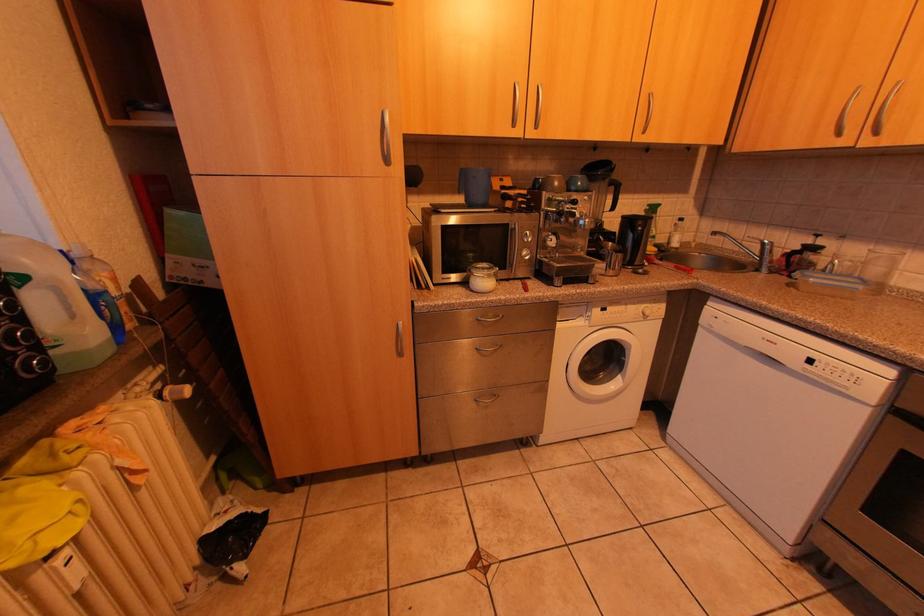
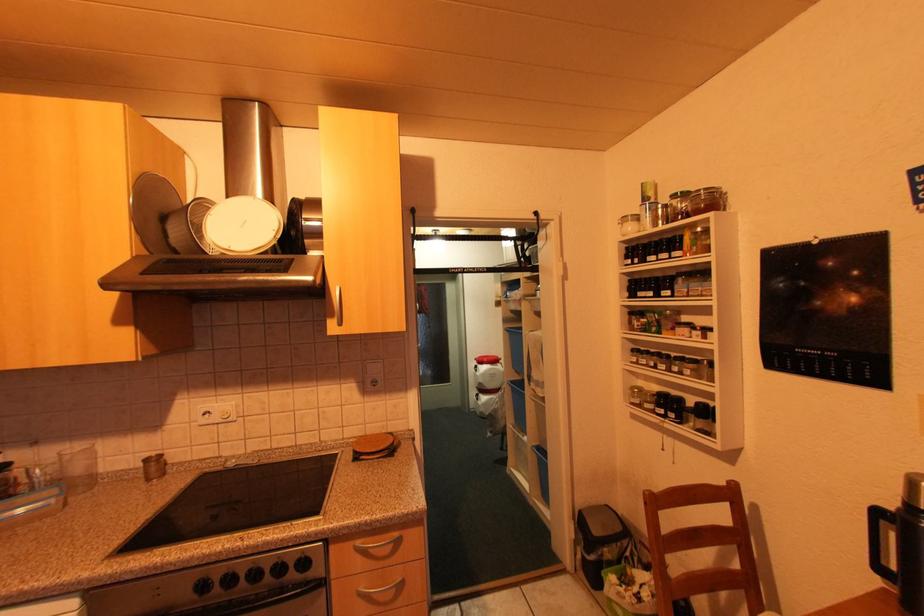
Question: The images are taken continuously from a first-person perspective. In which direction is your viewpoint rotating?

Choices:
 (A) Left
 (B) Right
 (C) Up
 (D) Down

Answer: (B)